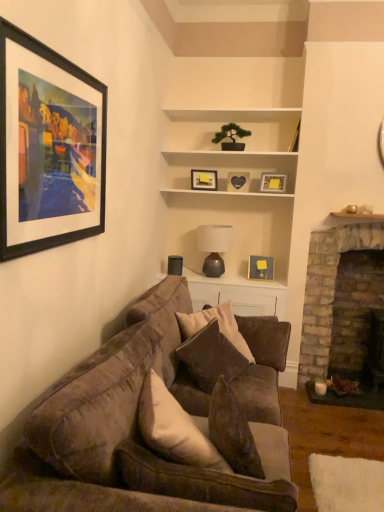
Question: In which direction should I rotate to look at velvet brown couch at center, the 1th studio couch when ordered from back to front?

Choices:
 (A) right
 (B) left

Answer: (A)

Question: Would you say matte gold picture frame at upper center, marked as the 1th picture frame in a right-to-left arrangement, is outside brick fireplace at right?

Choices:
 (A) no
 (B) yes

Answer: (B)

Question: Considering the relative positions of matte gold picture frame at upper center, which ranks as the 4th picture frame in back-to-front order, and brick fireplace at right in the image provided, is matte gold picture frame at upper center, which ranks as the 4th picture frame in back-to-front order, to the right of brick fireplace at right from the viewer's perspective?

Choices:
 (A) yes
 (B) no

Answer: (B)

Question: From the image's perspective, would you say matte gold picture frame at upper center, which ranks as the 4th picture frame in back-to-front order, is positioned over brick fireplace at right?

Choices:
 (A) yes
 (B) no

Answer: (A)

Question: Is matte gold picture frame at upper center, which ranks as the 4th picture frame in back-to-front order, positioned in front of brick fireplace at right?

Choices:
 (A) no
 (B) yes

Answer: (A)

Question: Is the position of matte gold picture frame at upper center, marked as the 1th picture frame in a right-to-left arrangement, more distant than that of brick fireplace at right?

Choices:
 (A) no
 (B) yes

Answer: (B)

Question: Considering the relative sizes of matte gold picture frame at upper center, which is the 5th picture frame in left-to-right order, and brick fireplace at right in the image provided, is matte gold picture frame at upper center, which is the 5th picture frame in left-to-right order, thinner than brick fireplace at right?

Choices:
 (A) no
 (B) yes

Answer: (B)

Question: Considering the relative sizes of matte gray lamp at center and brick fireplace at right in the image provided, is matte gray lamp at center smaller than brick fireplace at right?

Choices:
 (A) yes
 (B) no

Answer: (A)

Question: From the image's perspective, is matte gray lamp at center under brick fireplace at right?

Choices:
 (A) no
 (B) yes

Answer: (A)

Question: Considering the relative sizes of matte gray lamp at center and brick fireplace at right in the image provided, is matte gray lamp at center bigger than brick fireplace at right?

Choices:
 (A) no
 (B) yes

Answer: (A)

Question: From a real-world perspective, does matte gray lamp at center stand above brick fireplace at right?

Choices:
 (A) no
 (B) yes

Answer: (B)

Question: Is the surface of matte gray lamp at center in direct contact with brick fireplace at right?

Choices:
 (A) yes
 (B) no

Answer: (B)

Question: Is matte gray lamp at center not close to brick fireplace at right?

Choices:
 (A) yes
 (B) no

Answer: (B)

Question: Can you confirm if white matte cabinet at center is bigger than brick fireplace at right?

Choices:
 (A) no
 (B) yes

Answer: (A)